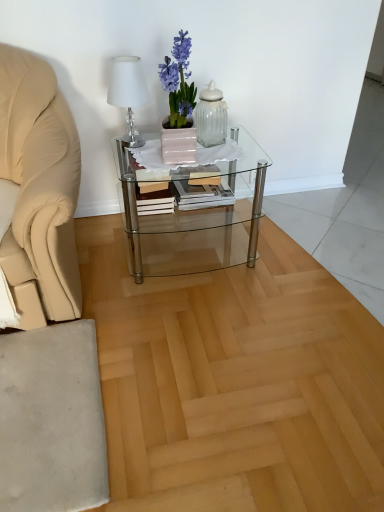
Question: Is clear glass jar at center further to the viewer compared to clear glass coffee table at center?

Choices:
 (A) yes
 (B) no

Answer: (A)

Question: Is clear glass jar at center at the right side of clear glass coffee table at center?

Choices:
 (A) no
 (B) yes

Answer: (B)

Question: Can you confirm if clear glass jar at center is shorter than clear glass coffee table at center?

Choices:
 (A) no
 (B) yes

Answer: (B)

Question: Does clear glass jar at center have a smaller size compared to clear glass coffee table at center?

Choices:
 (A) no
 (B) yes

Answer: (B)

Question: Does clear glass jar at center have a greater height compared to clear glass coffee table at center?

Choices:
 (A) no
 (B) yes

Answer: (A)

Question: From the image's perspective, relative to clear glass jar at center, is clear glass coffee table at center above or below?

Choices:
 (A) below
 (B) above

Answer: (A)

Question: In the image, is clear glass coffee table at center positioned in front of or behind clear glass jar at center?

Choices:
 (A) behind
 (B) front

Answer: (B)

Question: From a real-world perspective, is clear glass coffee table at center positioned above or below clear glass jar at center?

Choices:
 (A) above
 (B) below

Answer: (B)

Question: Considering the positions of point (248, 233) and point (198, 130), is point (248, 233) closer or farther from the camera than point (198, 130)?

Choices:
 (A) closer
 (B) farther

Answer: (B)

Question: From the image's perspective, is white fabric lampshade at upper left positioned above or below clear glass coffee table at center?

Choices:
 (A) above
 (B) below

Answer: (A)

Question: In terms of size, does white fabric lampshade at upper left appear bigger or smaller than clear glass coffee table at center?

Choices:
 (A) small
 (B) big

Answer: (A)

Question: From a real-world perspective, is white fabric lampshade at upper left positioned above or below clear glass coffee table at center?

Choices:
 (A) below
 (B) above

Answer: (B)

Question: Is white fabric lampshade at upper left taller or shorter than clear glass coffee table at center?

Choices:
 (A) tall
 (B) short

Answer: (B)

Question: Considering the positions of wooden book at center and clear glass coffee table at center in the image, is wooden book at center taller or shorter than clear glass coffee table at center?

Choices:
 (A) short
 (B) tall

Answer: (A)

Question: From the image's perspective, is wooden book at center located above or below clear glass coffee table at center?

Choices:
 (A) above
 (B) below

Answer: (A)